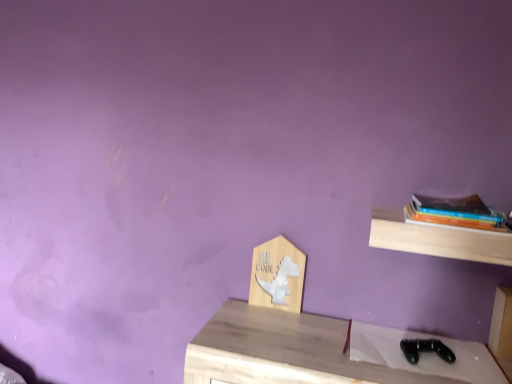
At what (x,y) coordinates should I click in order to perform the action: click on vacant space underneath light wood shelf at upper right, the 2th shelf from the left (from a real-world perspective). Please return your answer as a coordinate pair (x, y). Looking at the image, I should click on (425, 340).